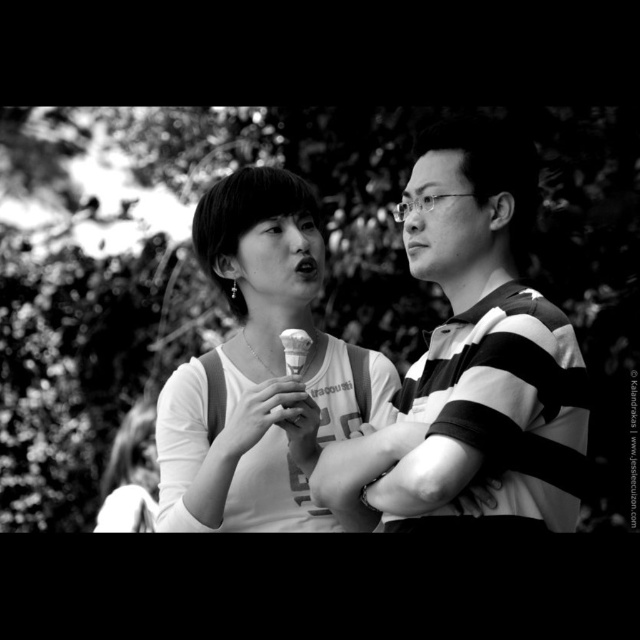
You are a photographer adjusting your camera settings to focus on two specific points in the image. The points are labeled as point [358,394] and point [285,365]. Which point should you focus on first if you want to ensure the closest object is in sharp focus?

Point [358,394] is closer to the camera than point [285,365], so you should focus on point [358,394] first to ensure the closest object is in sharp focus.

In the scene described, there are two main objects of interest. The striped fabric shirt at right and the white paper ice cream cone at center. From the perspective of someone standing in front of the image, which object is positioned to the right of the other?

The striped fabric shirt at right is positioned to the right of the white paper ice cream cone at center.